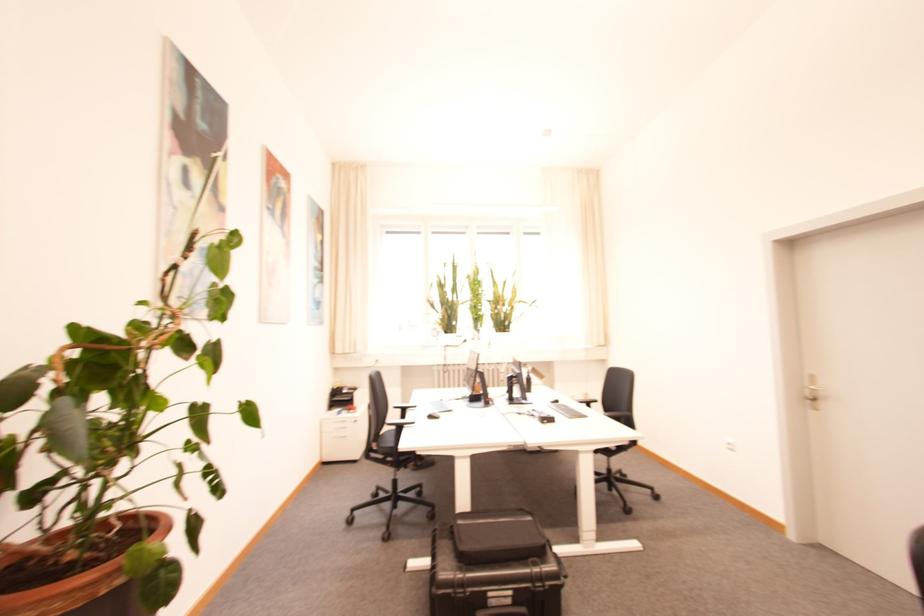
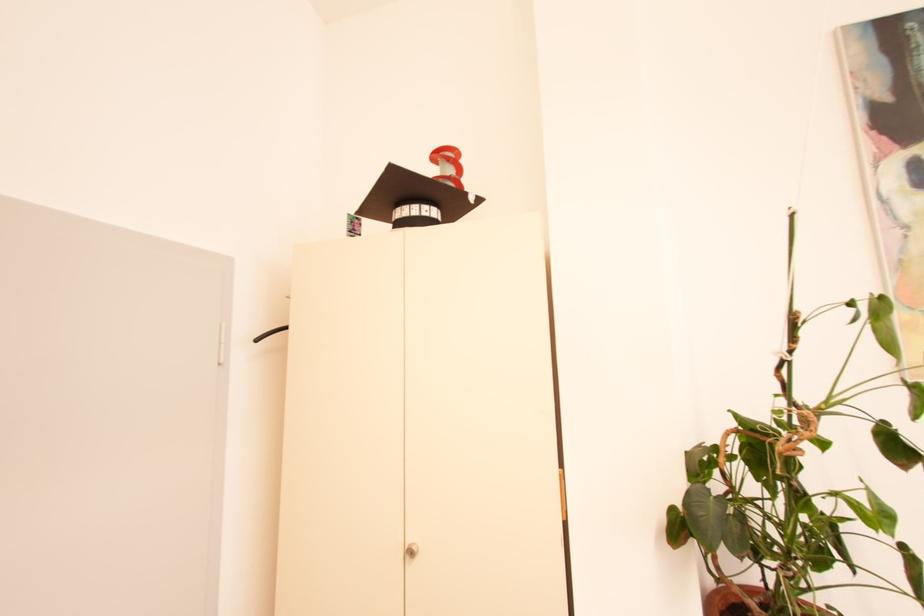
Question: The first image is from the beginning of the video and the second image is from the end. How did the camera likely rotate when shooting the video?

Choices:
 (A) Left
 (B) Right
 (C) Up
 (D) Down

Answer: (A)